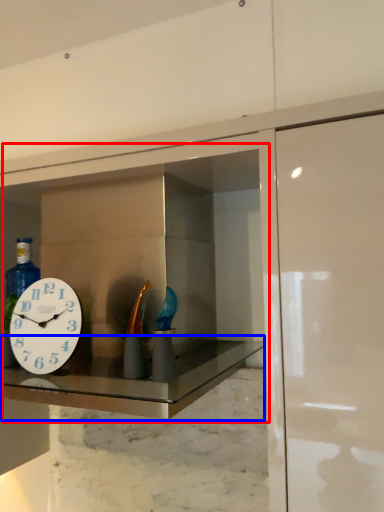
Question: Which of the following is the closest to the observer, medicine cabinet (highlighted by a red box) or counter top (highlighted by a blue box)?

Choices:
 (A) medicine cabinet
 (B) counter top

Answer: (B)